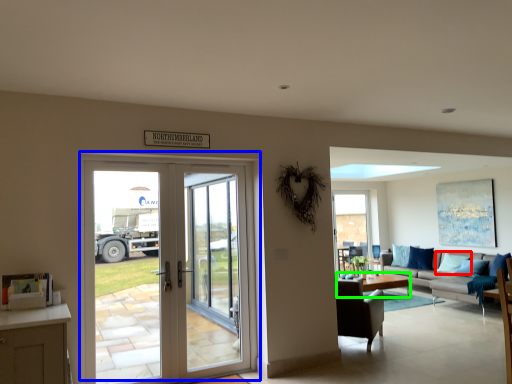
Question: Based on their relative distances, which object is nearer to pillow (highlighted by a red box)? Choose from door (highlighted by a blue box) and coffee table (highlighted by a green box).

Choices:
 (A) door
 (B) coffee table

Answer: (B)